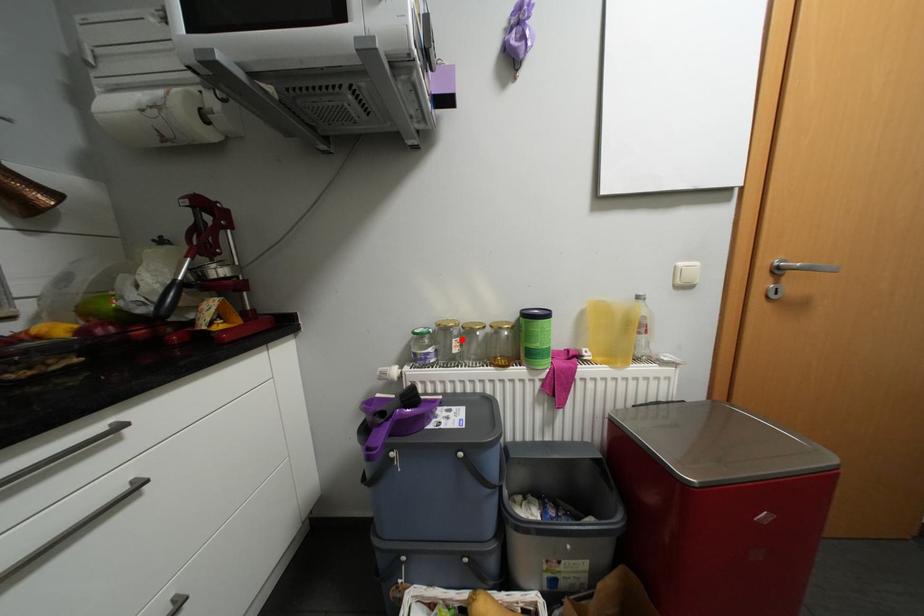
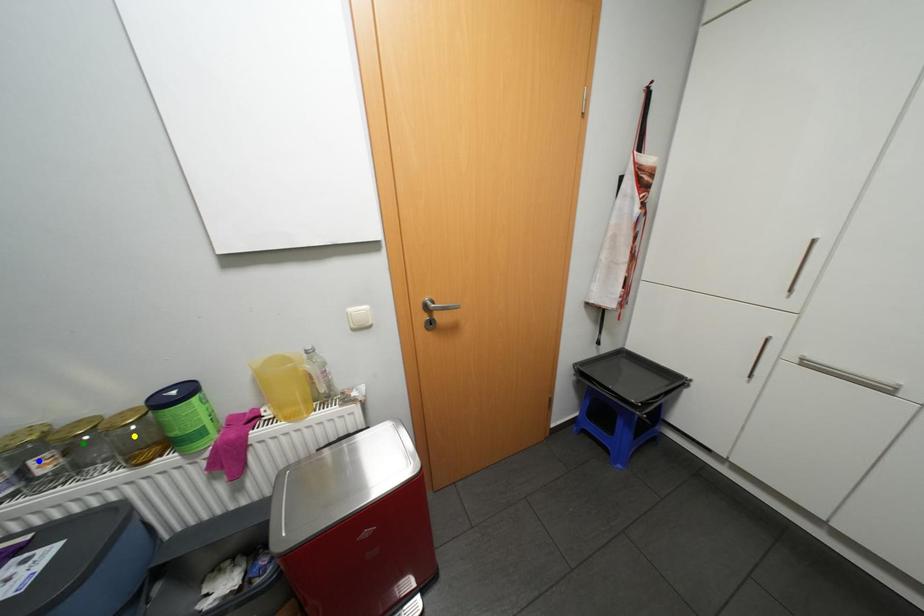
Question: I am providing you with two images of the same scene from different viewpoints. A red point is marked on the first image. You are given multiple points on the second image. Which point in image 2 is actually the same real-world point as the red point in image 1?

Choices:
 (A) yellow point
 (B) blue point
 (C) green point

Answer: (B)